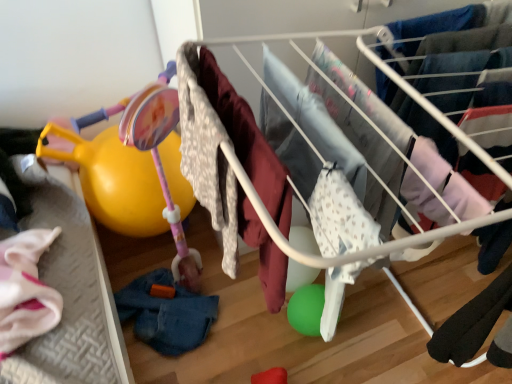
This screenshot has width=512, height=384. What do you see at coordinates (143, 173) in the screenshot?
I see `matte pink plastic baby carriage at left` at bounding box center [143, 173].

I want to click on matte pink plastic baby carriage at left, so click(x=143, y=173).

Find the location of a particular element. This screenshot has width=512, height=384. denim at lower left, arranged as the first clothing when ordered from the bottom is located at coordinates (166, 313).

Find the location of a particular element. matte pink plastic baby carriage at left is located at coordinates (143, 173).

I want to click on clothing below the white fabric baby clothes at center (from a real-world perspective), so click(166, 313).

In terms of size, does denim at lower left, arranged as the first clothing when ordered from the bottom, appear bigger or smaller than white fabric baby clothes at center?

In the image, denim at lower left, arranged as the first clothing when ordered from the bottom, appears to be smaller than white fabric baby clothes at center.

How many degrees apart are the facing directions of denim at lower left, which is the 2th clothing in top-to-bottom order, and white fabric baby clothes at center?

They differ by 9.08e-06 degrees in their facing directions.

Is denim at lower left, arranged as the first clothing when ordered from the bottom, oriented away from white fabric baby clothes at center?

No, denim at lower left, arranged as the first clothing when ordered from the bottom, is not facing away from white fabric baby clothes at center.

Between matte pink plastic baby carriage at left and denim at lower left, which is counted as the first clothing, starting from the left, which one appears on the left side from the viewer's perspective?

From the viewer's perspective, matte pink plastic baby carriage at left appears more on the left side.

Is matte pink plastic baby carriage at left bigger than denim at lower left, the 1th clothing when ordered from back to front?

Yes.

Which point is more distant from viewer, (166, 129) or (195, 325)?

The point (195, 325) is more distant.

Would you say denim at lower left, which is the 2th clothing in top-to-bottom order, contains matte pink plastic baby carriage at left?

No, denim at lower left, which is the 2th clothing in top-to-bottom order, does not contain matte pink plastic baby carriage at left.

Would you say denim at lower left, which is the 2th clothing in top-to-bottom order, is to the left or to the right of matte pink plastic baby carriage at left in the picture?

Result: From the image, it's evident that denim at lower left, which is the 2th clothing in top-to-bottom order, is to the right of matte pink plastic baby carriage at left.

Is denim at lower left, which is counted as the first clothing, starting from the left, behind matte pink plastic baby carriage at left?

Yes, the depth of denim at lower left, which is counted as the first clothing, starting from the left, is greater than that of matte pink plastic baby carriage at left.

Is white fabric baby clothes at center bigger or smaller than fluffy white blanket at center, which is the 1th clothing from front to back?

Considering their sizes, white fabric baby clothes at center takes up more space than fluffy white blanket at center, which is the 1th clothing from front to back.

From the image's perspective, between white fabric baby clothes at center and fluffy white blanket at center, the second clothing when ordered from bottom to top, who is located below?

From the image's view, fluffy white blanket at center, the second clothing when ordered from bottom to top, is below.

Image resolution: width=512 pixels, height=384 pixels. There is a white fabric baby clothes at center. Identify the location of the 1st clothing below it (from the image's perspective). (248, 141).

Does point (195, 117) appear closer or farther from the camera than point (274, 159)?

Point (195, 117).

Considering the relative sizes of matte pink plastic baby carriage at left and fluffy white blanket at center, which is the 1th clothing from front to back, in the image provided, is matte pink plastic baby carriage at left smaller than fluffy white blanket at center, which is the 1th clothing from front to back,?

No.

Is matte pink plastic baby carriage at left further to camera compared to fluffy white blanket at center, acting as the second clothing starting from the back?

That is True.

Is point (188, 248) closer or farther from the camera than point (236, 135)?

Point (188, 248) is positioned farther from the camera compared to point (236, 135).

Can you confirm if fluffy white blanket at center, the 2th clothing in the left-to-right sequence, is shorter than denim at lower left, the 1th clothing when ordered from back to front?

Incorrect, the height of fluffy white blanket at center, the 2th clothing in the left-to-right sequence, does not fall short of that of denim at lower left, the 1th clothing when ordered from back to front.

Does fluffy white blanket at center, acting as the second clothing starting from the back, turn towards denim at lower left, arranged as the first clothing when ordered from the bottom?

No, fluffy white blanket at center, acting as the second clothing starting from the back, is not facing towards denim at lower left, arranged as the first clothing when ordered from the bottom.

Is fluffy white blanket at center, which is the 1th clothing from front to back, behind denim at lower left, arranged as the first clothing when ordered from the bottom?

No, fluffy white blanket at center, which is the 1th clothing from front to back, is closer to the viewer.

Is point (246, 216) closer to viewer compared to point (143, 283)?

Yes, it is in front of point (143, 283).

From the image's perspective, which is above, fluffy white blanket at center, the 1th clothing viewed from the top, or white fabric baby clothes at center?

white fabric baby clothes at center.

Is fluffy white blanket at center, the 1th clothing when ordered from right to left, touching white fabric baby clothes at center?

No.

How different are the orientations of fluffy white blanket at center, the 1th clothing when ordered from right to left, and white fabric baby clothes at center in degrees?

The angular difference between fluffy white blanket at center, the 1th clothing when ordered from right to left, and white fabric baby clothes at center is 1.37e-05 degrees.

Where is `infant bed located above the denim at lower left, the 1th clothing when ordered from back to front (from the image's perspective)`? The image size is (512, 384). infant bed located above the denim at lower left, the 1th clothing when ordered from back to front (from the image's perspective) is located at coordinates (394, 152).

Locate an element on the screen. baby carriage in front of the denim at lower left, which is counted as the first clothing, starting from the left is located at coordinates (143, 173).

Based on their spatial positions, is white fabric baby clothes at center or matte pink plastic baby carriage at left further from fluffy white blanket at center, the second clothing when ordered from bottom to top?

matte pink plastic baby carriage at left lies further to fluffy white blanket at center, the second clothing when ordered from bottom to top, than the other object.

Based on their spatial positions, is white fabric baby clothes at center or matte pink plastic baby carriage at left closer to denim at lower left, which is the second clothing from front to back?

Based on the image, matte pink plastic baby carriage at left appears to be nearer to denim at lower left, which is the second clothing from front to back.

Which object lies nearer to the anchor point matte pink plastic baby carriage at left, white fabric baby clothes at center or denim at lower left, the 1th clothing when ordered from back to front?

The object closer to matte pink plastic baby carriage at left is denim at lower left, the 1th clothing when ordered from back to front.

Considering their positions, is fluffy white blanket at center, the 2th clothing in the left-to-right sequence, positioned further to white fabric baby clothes at center than denim at lower left, arranged as the first clothing when ordered from the bottom?

Based on the image, denim at lower left, arranged as the first clothing when ordered from the bottom, appears to be further to white fabric baby clothes at center.

Considering their positions, is white fabric baby clothes at center positioned further to denim at lower left, which is the 2th clothing in top-to-bottom order, than fluffy white blanket at center, the 1th clothing viewed from the top?

white fabric baby clothes at center lies further to denim at lower left, which is the 2th clothing in top-to-bottom order, than the other object.

Based on the photo, from the image, which object appears to be farther from white fabric baby clothes at center, fluffy white blanket at center, the second clothing when ordered from bottom to top, or matte pink plastic baby carriage at left?

The object further to white fabric baby clothes at center is matte pink plastic baby carriage at left.

Estimate the real-world distances between objects in this image. Which object is further from fluffy white blanket at center, which is the 1th clothing from front to back, matte pink plastic baby carriage at left or white fabric baby clothes at center?

The object further to fluffy white blanket at center, which is the 1th clothing from front to back, is matte pink plastic baby carriage at left.

Based on their spatial positions, is fluffy white blanket at center, which is the 1th clothing from front to back, or white fabric baby clothes at center closer to matte pink plastic baby carriage at left?

Based on the image, fluffy white blanket at center, which is the 1th clothing from front to back, appears to be nearer to matte pink plastic baby carriage at left.

The image size is (512, 384). I want to click on baby carriage between white fabric baby clothes at center and denim at lower left, which appears as the 2th clothing when viewed from the right, in the front-back direction, so click(x=143, y=173).

Identify the location of infant bed between fluffy white blanket at center, acting as the second clothing starting from the back, and denim at lower left, arranged as the first clothing when ordered from the bottom, from front to back. pos(394,152).

This screenshot has height=384, width=512. In order to click on baby carriage between fluffy white blanket at center, the 2th clothing in the left-to-right sequence, and denim at lower left, arranged as the first clothing when ordered from the bottom, in the front-back direction in this screenshot , I will do `click(143, 173)`.